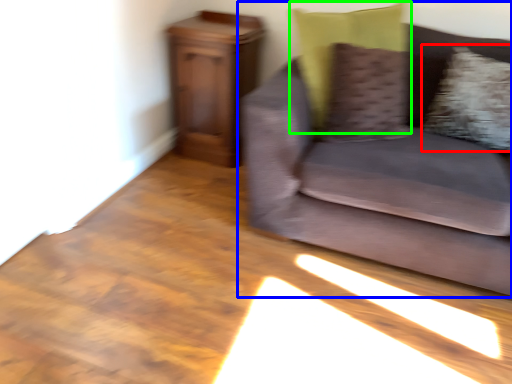
Question: Which object is the farthest from pillow (highlighted by a red box)? Choose among these: studio couch (highlighted by a blue box) or pillow (highlighted by a green box).

Choices:
 (A) studio couch
 (B) pillow

Answer: (B)